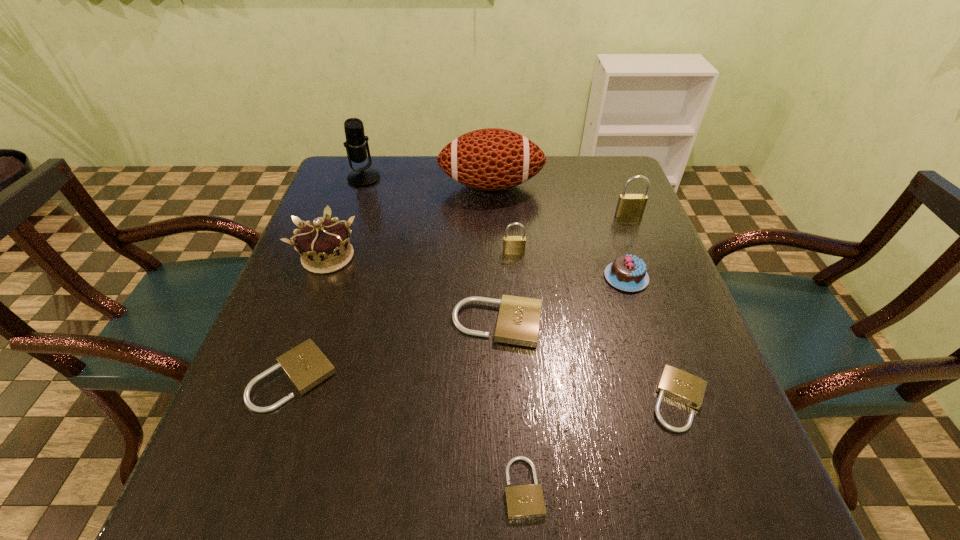
At what (x,y) coordinates should I click in order to perform the action: click on free spot located 0.080m on the right of the gold crown. Please return your answer as a coordinate pair (x, y). This screenshot has height=540, width=960. Looking at the image, I should click on (393, 257).

Find the location of `vacant point located on the front-facing side of the left brass padlock`. vacant point located on the front-facing side of the left brass padlock is located at coordinates (517, 301).

Where is `free spot located on the front of the chocolate cake`? free spot located on the front of the chocolate cake is located at coordinates (647, 341).

Identify the location of free spot located 0.280m on the back of the fourth shortest object. The image size is (960, 540). (493, 221).

I want to click on vacant space situated on the back of the second biggest beige padlock, so click(x=328, y=280).

Find the location of a particular element. The height and width of the screenshot is (540, 960). vacant space located 0.130m on the left of the fifth tallest padlock is located at coordinates (576, 400).

Where is `vacant space located on the right of the smallest beige padlock`? vacant space located on the right of the smallest beige padlock is located at coordinates (744, 487).

Locate an element on the screen. microphone located at the far edge is located at coordinates (356, 143).

The width and height of the screenshot is (960, 540). Identify the location of football located at the far edge. (491, 159).

Image resolution: width=960 pixels, height=540 pixels. Identify the location of object located in the near edge section of the desktop. (524, 501).